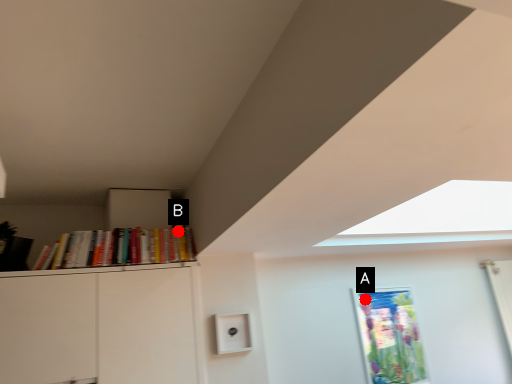
Question: Two points are circled on the image, labeled by A and B beside each circle. Which point is closer to the camera taking this photo?

Choices:
 (A) A is closer
 (B) B is closer

Answer: (B)